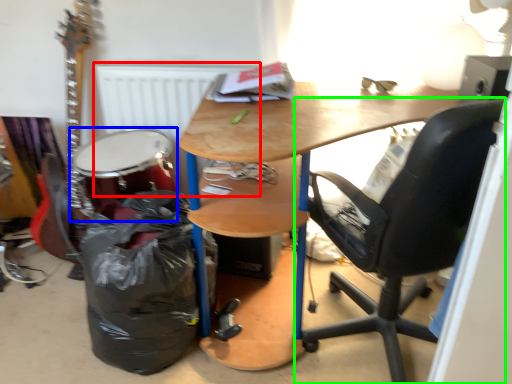
Question: Considering the real-world distances, which object is farthest from radiator (highlighted by a red box)? drum (highlighted by a blue box) or chair (highlighted by a green box)?

Choices:
 (A) drum
 (B) chair

Answer: (B)